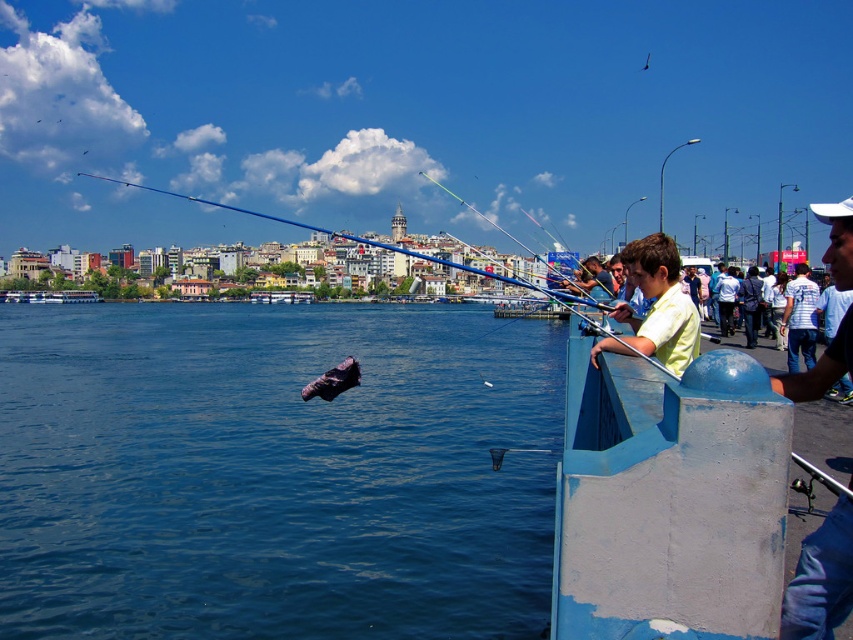
In the scene shown: Between dark blue water at center and white plastic boat at left, which one appears on the right side from the viewer's perspective?

dark blue water at center is more to the right.

Is point (25, 634) less distant than point (0, 301)?

Yes, point (25, 634) is closer to viewer.

Locate an element on the screen. dark blue water at center is located at coordinates (274, 472).

Can you confirm if dark blue water at center is positioned to the left of white striped shirt at right?

Indeed, dark blue water at center is positioned on the left side of white striped shirt at right.

Between point (323, 488) and point (804, 291), which one is positioned behind?

Positioned behind is point (804, 291).

Does point (396, 509) lie behind point (799, 269)?

No, it is in front of (799, 269).

Locate an element on the screen. Image resolution: width=853 pixels, height=640 pixels. dark blue water at center is located at coordinates (274, 472).

Is denim jeans at right to the right of white plastic boat at left from the viewer's perspective?

Correct, you'll find denim jeans at right to the right of white plastic boat at left.

Does point (850, 529) lie behind point (64, 291)?

No.

Find the location of `denim jeans at right`. denim jeans at right is located at coordinates (821, 579).